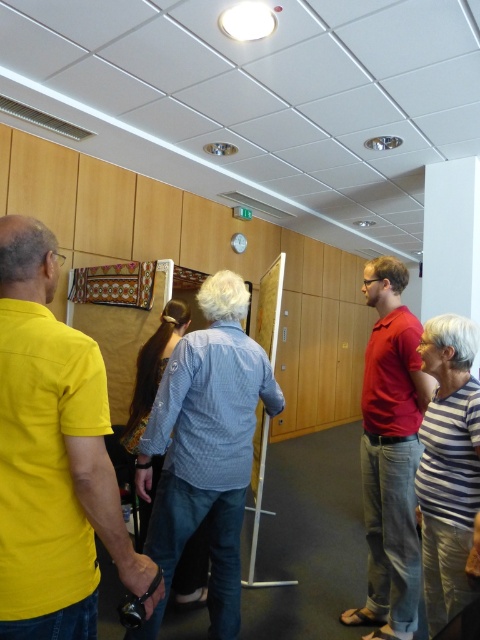
Is denim shirt at center taller than matte red shirt at center?

In fact, denim shirt at center may be shorter than matte red shirt at center.

Can you confirm if denim shirt at center is shorter than matte red shirt at center?

Yes.

This screenshot has width=480, height=640. Find the location of `denim shirt at center`. denim shirt at center is located at coordinates (206, 444).

This screenshot has height=640, width=480. I want to click on denim shirt at center, so click(206, 444).

Does yellow matte shirt at left come in front of denim shirt at center?

Yes.

Can you confirm if yellow matte shirt at left is positioned to the left of denim shirt at center?

Correct, you'll find yellow matte shirt at left to the left of denim shirt at center.

Is point (4, 600) positioned after point (214, 531)?

That is False.

In order to click on yellow matte shirt at left in this screenshot , I will do `click(52, 456)`.

Can you confirm if yellow matte shirt at left is positioned above matte red shirt at center?

Correct, yellow matte shirt at left is located above matte red shirt at center.

Is yellow matte shirt at left positioned in front of matte red shirt at center?

Yes, yellow matte shirt at left is closer to the viewer.

Between point (63, 369) and point (379, 596), which one is positioned in front?

Point (63, 369)

You are a GUI agent. You are given a task and a screenshot of the screen. Output one action in this format:
    pyautogui.click(x=<x>, y=<y>)
    Task: Click on the yellow matte shirt at left
    The image size is (480, 640).
    Given the screenshot: What is the action you would take?
    pyautogui.click(x=52, y=456)